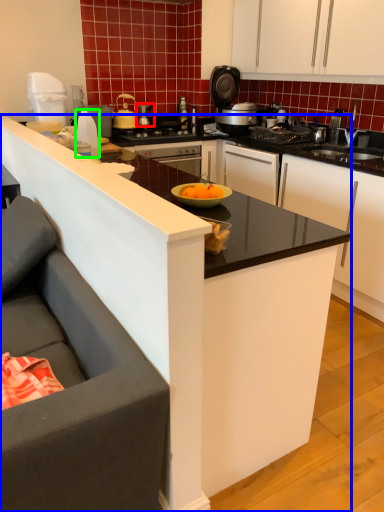
Question: Which is farther away from kitchen appliance (highlighted by a red box)? countertop (highlighted by a blue box) or kitchen appliance (highlighted by a green box)?

Choices:
 (A) countertop
 (B) kitchen appliance

Answer: (A)